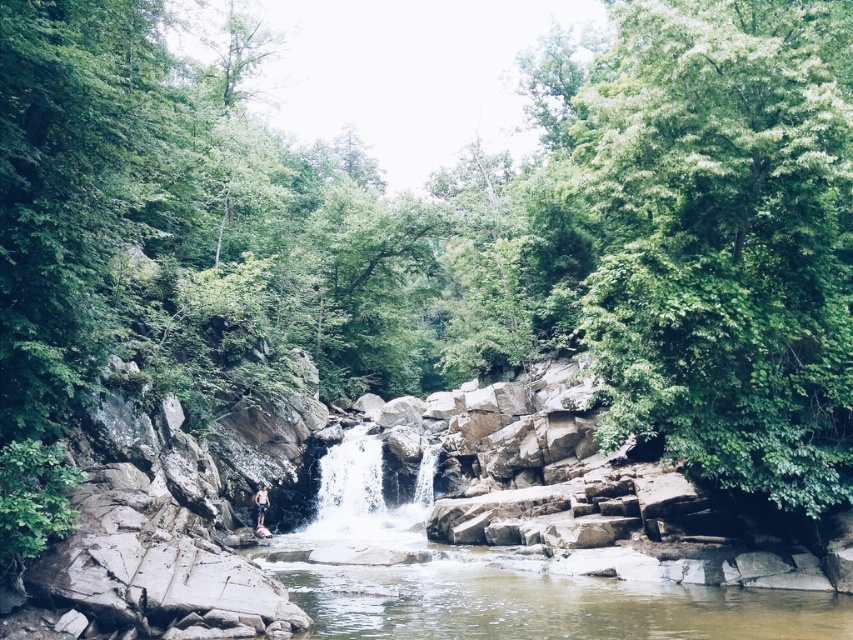
You are standing at the edge of the brown rock river at center in the serene natural scene. You notice a point marked at coordinates (544,604). Based on the description, where exactly is this point located in relation to the brown rock river at center?

The point at coordinates (544,604) is located on the brown rock river at center.

You are a hiker who has just arrived at the waterfall. You see clear water at center and tan shorts at center. Which object is higher up in the scene?

The clear water at center is much taller than the tan shorts at center, so the clear water at center is higher up in the scene.